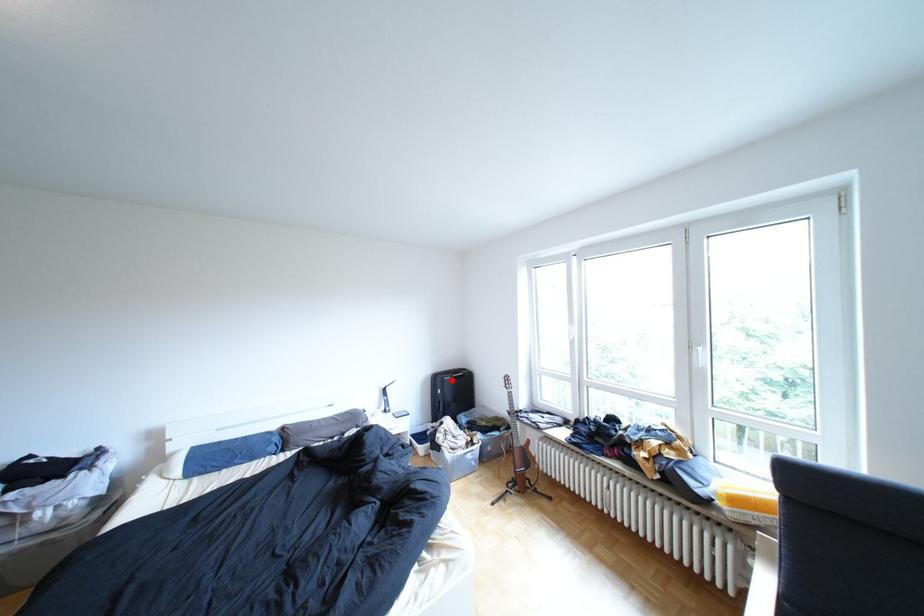
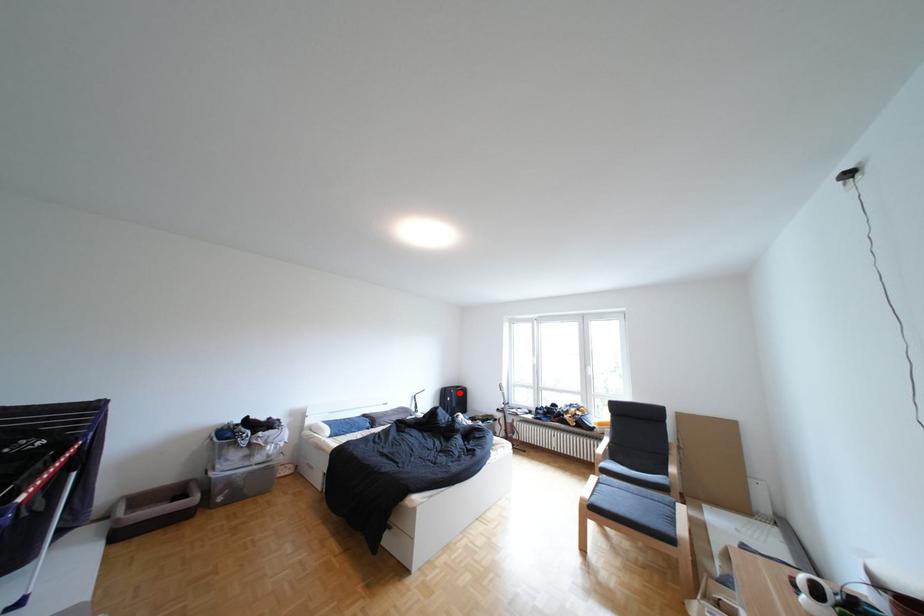
I am providing you with two images of the same scene from different viewpoints. A red point is marked on the first image and another point is marked on the second image. Is the marked point in image1 the same physical position as the marked point in image2?

Yes